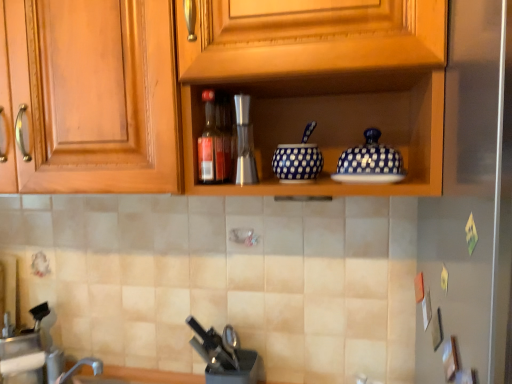
Describe the element at coordinates (210, 145) in the screenshot. I see `matte glass bottle at center` at that location.

This screenshot has height=384, width=512. What are the coordinates of `silver metallic coffee machine at center` in the screenshot? It's located at (243, 144).

Locate an element on the screen. The height and width of the screenshot is (384, 512). blue dotted bowl at center is located at coordinates (298, 160).

This screenshot has height=384, width=512. Find the location of `blue polka dot ceramic bowl at upper right`. blue polka dot ceramic bowl at upper right is located at coordinates (371, 159).

The image size is (512, 384). Find the location of `black plastic knife block at lower center`. black plastic knife block at lower center is located at coordinates (224, 355).

Can you confirm if blue polka dot ceramic bowl at upper right is smaller than wooden cabinet at upper center?

Yes, blue polka dot ceramic bowl at upper right is smaller than wooden cabinet at upper center.

Which object is positioned more to the left, blue polka dot ceramic bowl at upper right or wooden cabinet at upper center?

wooden cabinet at upper center is more to the left.

Would you say blue polka dot ceramic bowl at upper right is inside or outside wooden cabinet at upper center?

blue polka dot ceramic bowl at upper right lies within the bounds of wooden cabinet at upper center.

In the scene shown: From the image's perspective, which one is positioned higher, blue polka dot ceramic bowl at upper right or wooden cabinet at upper center?

wooden cabinet at upper center is shown above in the image.

From a real-world perspective, which object rests below the other?

blue dotted bowl at center is physically lower.

Considering the positions of objects blue dotted bowl at center and silver metallic coffee machine at center in the image provided, who is more to the right, blue dotted bowl at center or silver metallic coffee machine at center?

blue dotted bowl at center.

From the image's perspective, is blue dotted bowl at center above or below silver metallic coffee machine at center?

blue dotted bowl at center is below silver metallic coffee machine at center.

Considering the sizes of objects blue dotted bowl at center and silver metallic coffee machine at center in the image provided, who is taller, blue dotted bowl at center or silver metallic coffee machine at center?

silver metallic coffee machine at center is taller.

Is matte glass bottle at center thinner than brushed metal faucet at lower left?

Yes, matte glass bottle at center is thinner than brushed metal faucet at lower left.

Which object is more forward, matte glass bottle at center or brushed metal faucet at lower left?

matte glass bottle at center.

How much distance is there between matte glass bottle at center and brushed metal faucet at lower left?

78.24 centimeters.

Which of these two, matte glass bottle at center or brushed metal faucet at lower left, is bigger?

With larger size is brushed metal faucet at lower left.

Is matte glass bottle at center behind blue dotted bowl at center?

No, it is in front of blue dotted bowl at center.

Based on their sizes in the image, would you say matte glass bottle at center is bigger or smaller than blue dotted bowl at center?

matte glass bottle at center is smaller than blue dotted bowl at center.

Is matte glass bottle at center facing away from blue dotted bowl at center?

That's not correct — matte glass bottle at center is not looking away from blue dotted bowl at center.

Considering the relative sizes of wooden cabinet at upper center and blue polka dot ceramic bowl at upper right in the image provided, is wooden cabinet at upper center wider than blue polka dot ceramic bowl at upper right?

Yes, wooden cabinet at upper center is wider than blue polka dot ceramic bowl at upper right.

From a real-world perspective, is wooden cabinet at upper center on blue polka dot ceramic bowl at upper right?

Yes, from a real-world perspective, wooden cabinet at upper center is above blue polka dot ceramic bowl at upper right.

Identify the location of cabinetry in front of the blue polka dot ceramic bowl at upper right. The width and height of the screenshot is (512, 384). (322, 83).

Considering the positions of objects wooden cabinet at upper center and blue polka dot ceramic bowl at upper right in the image provided, who is more to the left, wooden cabinet at upper center or blue polka dot ceramic bowl at upper right?

From the viewer's perspective, wooden cabinet at upper center appears more on the left side.

Is brushed metal faucet at lower left looking in the opposite direction of silver metallic coffee machine at center?

brushed metal faucet at lower left does not have its back to silver metallic coffee machine at center.

Is there a large distance between brushed metal faucet at lower left and silver metallic coffee machine at center?

No, there isn't a large distance between brushed metal faucet at lower left and silver metallic coffee machine at center.

Could silver metallic coffee machine at center be considered to be inside brushed metal faucet at lower left?

That's incorrect, silver metallic coffee machine at center is not inside brushed metal faucet at lower left.

Considering the relative sizes of black plastic knife block at lower center and matte glass bottle at center in the image provided, is black plastic knife block at lower center shorter than matte glass bottle at center?

Yes, black plastic knife block at lower center is shorter than matte glass bottle at center.

Considering the positions of point (223, 334) and point (209, 129), is point (223, 334) closer or farther from the camera than point (209, 129)?

Point (223, 334) appears to be farther away from the viewer than point (209, 129).

Is black plastic knife block at lower center next to matte glass bottle at center?

No, black plastic knife block at lower center is not beside matte glass bottle at center.

Could matte glass bottle at center be considered to be inside black plastic knife block at lower center?

No, matte glass bottle at center is not inside black plastic knife block at lower center.

This screenshot has width=512, height=384. In order to click on cabinetry above the blue polka dot ceramic bowl at upper right (from the image's perspective) in this screenshot , I will do `click(322, 83)`.

Identify the location of tableware below the silver metallic coffee machine at center (from the image's perspective). The image size is (512, 384). (298, 160).

Considering their positions, is brushed metal faucet at lower left positioned closer to matte glass bottle at center than blue dotted bowl at center?

blue dotted bowl at center is positioned closer to the anchor matte glass bottle at center.

Based on their spatial positions, is blue polka dot ceramic bowl at upper right or wooden cabinet at upper center closer to matte glass bottle at center?

Based on the image, wooden cabinet at upper center appears to be nearer to matte glass bottle at center.

When comparing their distances from blue dotted bowl at center, does blue polka dot ceramic bowl at upper right or silver metallic coffee machine at center seem further?

blue polka dot ceramic bowl at upper right is positioned further to the anchor blue dotted bowl at center.

Considering their positions, is matte glass bottle at center positioned further to silver metallic coffee machine at center than wooden cabinet at upper center?

The object further to silver metallic coffee machine at center is wooden cabinet at upper center.

Considering their positions, is blue polka dot ceramic bowl at upper right positioned closer to black plastic knife block at lower center than wooden cabinet at upper center?

blue polka dot ceramic bowl at upper right is positioned closer to the anchor black plastic knife block at lower center.

Estimate the real-world distances between objects in this image. Which object is further from silver metallic coffee machine at center, blue polka dot ceramic bowl at upper right or matte glass bottle at center?

blue polka dot ceramic bowl at upper right lies further to silver metallic coffee machine at center than the other object.

Estimate the real-world distances between objects in this image. Which object is further from silver metallic coffee machine at center, wooden cabinet at upper center or brushed metal faucet at lower left?

Among the two, brushed metal faucet at lower left is located further to silver metallic coffee machine at center.

Which object lies nearer to the anchor point blue polka dot ceramic bowl at upper right, wooden cabinet at upper center or brushed metal faucet at lower left?

The object closer to blue polka dot ceramic bowl at upper right is wooden cabinet at upper center.

At what (x,y) coordinates should I click in order to perform the action: click on tableware between matte glass bottle at center and brushed metal faucet at lower left in the vertical direction. Please return your answer as a coordinate pair (x, y). This screenshot has width=512, height=384. Looking at the image, I should click on [x=298, y=160].

Locate an element on the screen. This screenshot has height=384, width=512. coffee machine between wooden cabinet at upper center and brushed metal faucet at lower left from top to bottom is located at coordinates (243, 144).

Find the location of a particular element. coffee machine located between wooden cabinet at upper center and blue dotted bowl at center in the left-right direction is located at coordinates (243, 144).

I want to click on tableware between wooden cabinet at upper center and brushed metal faucet at lower left in the up-down direction, so point(298,160).